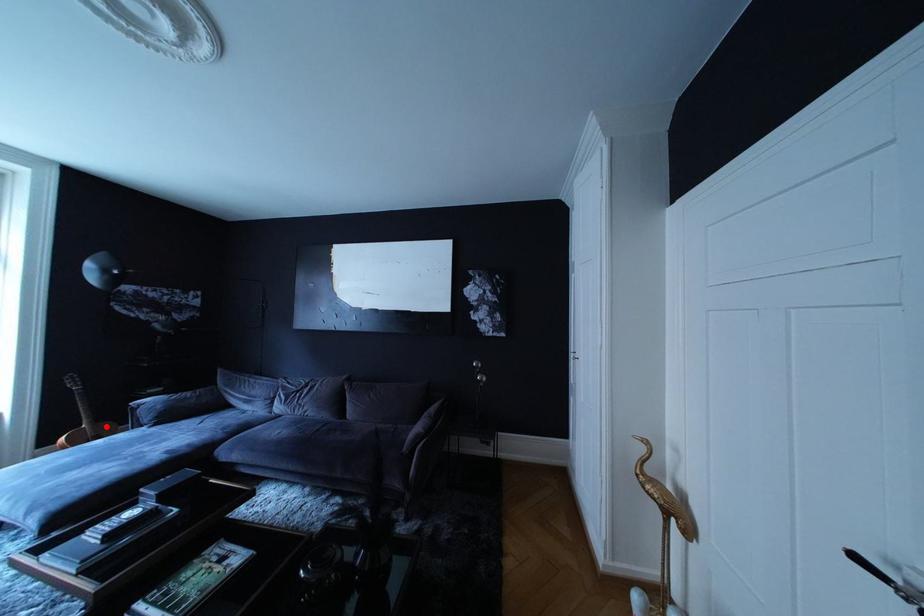
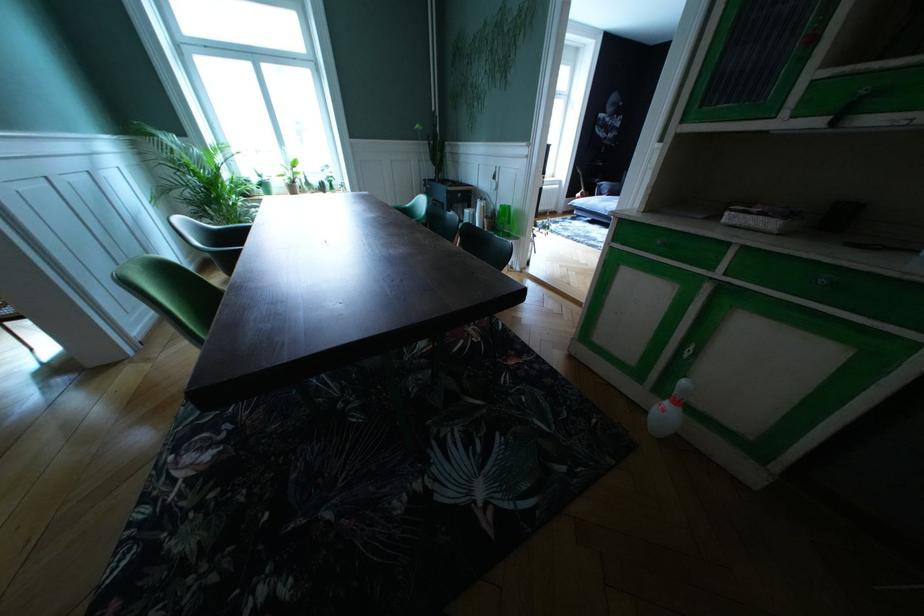
Question: I am providing you with two images of the same scene from different viewpoints. A red point is marked on the first image. Can you still see the location of the red point in image 2?

Choices:
 (A) Yes
 (B) No

Answer: (B)